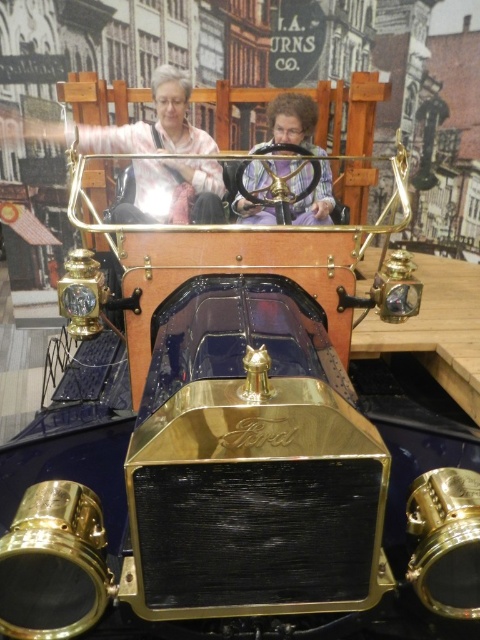
You are a fashion designer looking at a display of clothing items. You see a matte pink sweater at upper center and a purple fabric at center. Which item is located to the left of the other?

The matte pink sweater at upper center is positioned on the left side of purple fabric at center.

You are an interior designer assessing a living room setup. You notice the matte pink sweater at upper center and the purple fabric at center. Which object would you recommend placing a decorative pin on to ensure it is more visible?

The matte pink sweater at upper center is larger in size than the purple fabric at center, so placing the decorative pin on the matte pink sweater at upper center would make it more visible due to its larger surface area.

You are a fashion designer examining a new clothing item displayed in a museum. You notice the matte pink sweater at upper center and the purple fabric at center. Which item is placed higher up in the display?

The matte pink sweater at upper center is positioned over the purple fabric at center, so it is placed higher up in the display.